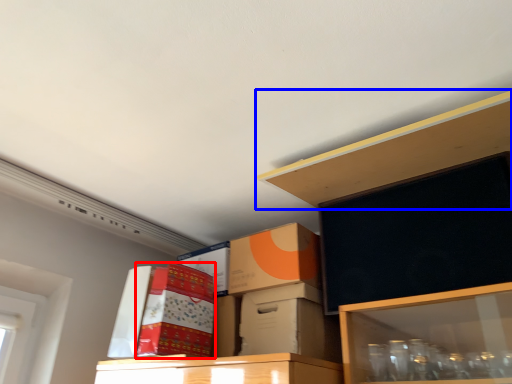
Question: Which object appears farthest to the camera in this image, storage box (highlighted by a red box) or shelf (highlighted by a blue box)?

Choices:
 (A) storage box
 (B) shelf

Answer: (A)